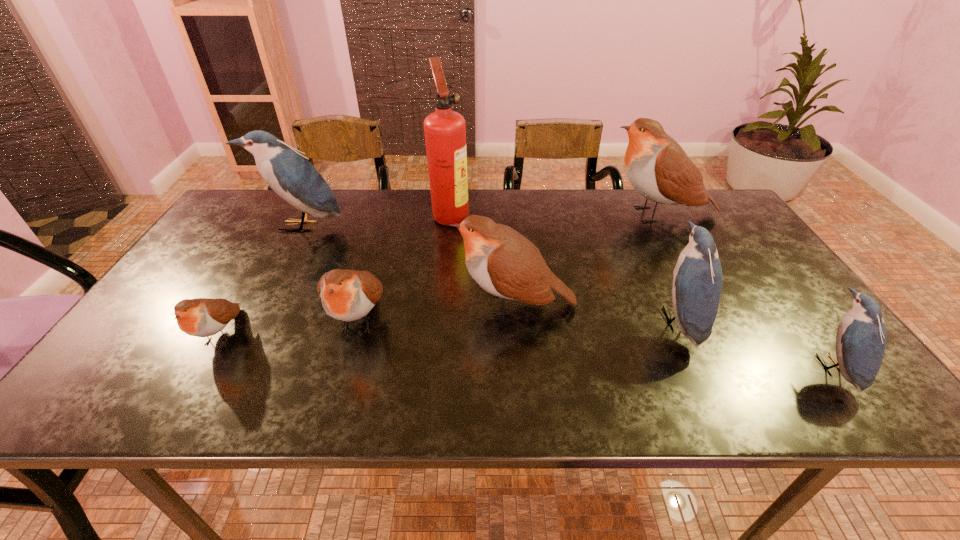
You are a GUI agent. You are given a task and a screenshot of the screen. Output one action in this format:
    pyautogui.click(x=<x>, y=<y>)
    Task: Click on the fire extinguisher that is at the far edge
    Image resolution: width=960 pixels, height=540 pixels.
    Given the screenshot: What is the action you would take?
    pyautogui.click(x=445, y=132)

Find the location of a particular element. This screenshot has height=540, width=960. object that is at the near edge is located at coordinates (861, 338).

You are a GUI agent. You are given a task and a screenshot of the screen. Output one action in this format:
    pyautogui.click(x=<x>, y=<y>)
    Task: Click on the object that is at the far left corner
    
    Given the screenshot: What is the action you would take?
    pyautogui.click(x=289, y=174)

This screenshot has height=540, width=960. Identify the location of object at the far right corner. pyautogui.click(x=657, y=167).

I want to click on object situated at the near right corner, so click(861, 338).

Where is `vacant region at the far edge`? vacant region at the far edge is located at coordinates (368, 198).

The height and width of the screenshot is (540, 960). Identify the location of vacant space at the near edge of the desktop. (582, 380).

In the image, there is a desktop. At what (x,y) coordinates should I click in order to perform the action: click on vacant space at the left edge. Please return your answer as a coordinate pair (x, y). Looking at the image, I should click on (x=198, y=274).

Find the location of a particular element. Image resolution: width=960 pixels, height=540 pixels. free space at the right edge of the desktop is located at coordinates (780, 370).

Where is `free space between the rightmost brown bird and the fire extinguisher`? free space between the rightmost brown bird and the fire extinguisher is located at coordinates (554, 214).